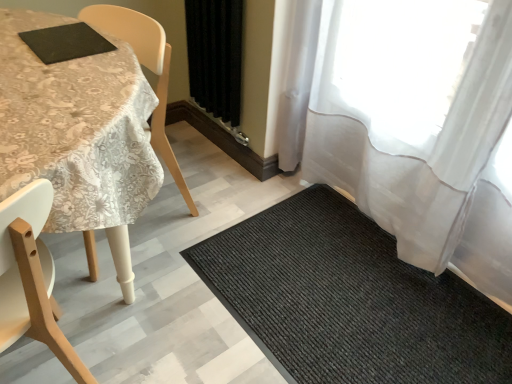
Find the location of a particular element. white lace tablecloth at upper left is located at coordinates (78, 134).

At what (x,y) coordinates should I click in order to perform the action: click on black fabric curtain at center, which ranks as the 2th curtain in right-to-left order. Please return your answer as a coordinate pair (x, y). Looking at the image, I should click on (215, 56).

What do you see at coordinates (215, 56) in the screenshot? Image resolution: width=512 pixels, height=384 pixels. I see `black fabric curtain at center, which ranks as the 2th curtain in right-to-left order` at bounding box center [215, 56].

Measure the distance between point (36, 268) and camera.

They are 30.55 inches apart.

Image resolution: width=512 pixels, height=384 pixels. What do you see at coordinates (31, 277) in the screenshot? I see `wooden chair at left` at bounding box center [31, 277].

The image size is (512, 384). Find the location of `white lace tablecloth at upper left`. white lace tablecloth at upper left is located at coordinates (78, 134).

What's the angular difference between sheer white curtain at right, placed as the 2th curtain when sorted from left to right, and black textured mat at lower right's facing directions?

The facing directions of sheer white curtain at right, placed as the 2th curtain when sorted from left to right, and black textured mat at lower right are 1.85 degrees apart.

Is sheer white curtain at right, the first curtain viewed from the right, smaller than black textured mat at lower right?

Incorrect, sheer white curtain at right, the first curtain viewed from the right, is not smaller in size than black textured mat at lower right.

From the picture: From the image's perspective, which is below, sheer white curtain at right, placed as the 2th curtain when sorted from left to right, or black textured mat at lower right?

black textured mat at lower right is shown below in the image.

Is sheer white curtain at right, placed as the 2th curtain when sorted from left to right, aimed at black textured mat at lower right?

Yes, sheer white curtain at right, placed as the 2th curtain when sorted from left to right, faces towards black textured mat at lower right.

From a real-world perspective, is black textured mat at lower right physically below wooden chair at left?

Yes.

Is wooden chair at left at the back of black textured mat at lower right?

No, wooden chair at left is not at the back of black textured mat at lower right.

From the image's perspective, is black textured mat at lower right above wooden chair at left?

No, from the image's perspective, black textured mat at lower right is not over wooden chair at left.

Is point (316, 283) behind point (11, 297)?

That is True.

Which is more to the right, sheer white curtain at right, placed as the 2th curtain when sorted from left to right, or wooden chair at left?

sheer white curtain at right, placed as the 2th curtain when sorted from left to right, is more to the right.

From a real-world perspective, which is physically above, sheer white curtain at right, placed as the 2th curtain when sorted from left to right, or wooden chair at left?

sheer white curtain at right, placed as the 2th curtain when sorted from left to right, is physically above.

From the image's perspective, who appears lower, sheer white curtain at right, placed as the 2th curtain when sorted from left to right, or wooden chair at left?

wooden chair at left appears lower in the image.

Could wooden chair at left be considered to be inside sheer white curtain at right, the first curtain viewed from the right?

No, wooden chair at left is located outside of sheer white curtain at right, the first curtain viewed from the right.

From the image's perspective, who appears lower, wooden chair at left or black fabric curtain at center, which ranks as the 2th curtain in right-to-left order?

wooden chair at left.

In terms of width, does wooden chair at left look wider or thinner when compared to black fabric curtain at center, positioned as the first curtain in left-to-right order?

In the image, wooden chair at left appears to be wider than black fabric curtain at center, positioned as the first curtain in left-to-right order.

Considering the sizes of objects wooden chair at left and black fabric curtain at center, which ranks as the 2th curtain in right-to-left order, in the image provided, who is taller, wooden chair at left or black fabric curtain at center, which ranks as the 2th curtain in right-to-left order,?

wooden chair at left.

How far apart are sheer white curtain at right, placed as the 2th curtain when sorted from left to right, and white lace tablecloth at upper left?

A distance of 37.21 inches exists between sheer white curtain at right, placed as the 2th curtain when sorted from left to right, and white lace tablecloth at upper left.

Is sheer white curtain at right, placed as the 2th curtain when sorted from left to right, oriented away from white lace tablecloth at upper left?

No.

From a real-world perspective, which object stands above the other?

In real-world perspective, sheer white curtain at right, placed as the 2th curtain when sorted from left to right, is above.

Between point (460, 165) and point (45, 74), which one is positioned behind?

The point (460, 165) is more distant.

Is black fabric curtain at center, positioned as the first curtain in left-to-right order, facing away from white lace tablecloth at upper left?

That's not correct — black fabric curtain at center, positioned as the first curtain in left-to-right order, is not looking away from white lace tablecloth at upper left.

Is the position of black fabric curtain at center, positioned as the first curtain in left-to-right order, more distant than that of white lace tablecloth at upper left?

Yes, it is.

Is the surface of black fabric curtain at center, which ranks as the 2th curtain in right-to-left order, in direct contact with white lace tablecloth at upper left?

black fabric curtain at center, which ranks as the 2th curtain in right-to-left order, is not next to white lace tablecloth at upper left, and they're not touching.

Consider the image. From the image's perspective, is black fabric curtain at center, positioned as the first curtain in left-to-right order, on top of white lace tablecloth at upper left?

Yes, from the image's perspective, black fabric curtain at center, positioned as the first curtain in left-to-right order, is over white lace tablecloth at upper left.

Where is `chair lying in front of the white lace tablecloth at upper left`? The height and width of the screenshot is (384, 512). chair lying in front of the white lace tablecloth at upper left is located at coordinates (31, 277).

From their relative heights in the image, would you say white lace tablecloth at upper left is taller or shorter than wooden chair at left?

Considering their sizes, white lace tablecloth at upper left has less height than wooden chair at left.

Can you confirm if white lace tablecloth at upper left is bigger than wooden chair at left?

Indeed, white lace tablecloth at upper left has a larger size compared to wooden chair at left.

This screenshot has height=384, width=512. In order to click on the 1st curtain above the black textured mat at lower right (from the image's perspective) in this screenshot , I will do `click(410, 112)`.

The height and width of the screenshot is (384, 512). I want to click on mat that is under the wooden chair at left (from a real-world perspective), so click(349, 300).

When comparing their distances from black fabric curtain at center, positioned as the first curtain in left-to-right order, does black textured mat at lower right or sheer white curtain at right, the first curtain viewed from the right, seem further?

Among the two, black textured mat at lower right is located further to black fabric curtain at center, positioned as the first curtain in left-to-right order.

Estimate the real-world distances between objects in this image. Which object is closer to sheer white curtain at right, placed as the 2th curtain when sorted from left to right, black fabric curtain at center, positioned as the first curtain in left-to-right order, or white lace tablecloth at upper left?

Among the two, black fabric curtain at center, positioned as the first curtain in left-to-right order, is located nearer to sheer white curtain at right, placed as the 2th curtain when sorted from left to right.

Considering their positions, is black fabric curtain at center, which ranks as the 2th curtain in right-to-left order, positioned further to sheer white curtain at right, placed as the 2th curtain when sorted from left to right, than wooden chair at left?

Among the two, wooden chair at left is located further to sheer white curtain at right, placed as the 2th curtain when sorted from left to right.

When comparing their distances from wooden chair at left, does white lace tablecloth at upper left or black fabric curtain at center, positioned as the first curtain in left-to-right order, seem further?

black fabric curtain at center, positioned as the first curtain in left-to-right order.

When comparing their distances from black textured mat at lower right, does white lace tablecloth at upper left or wooden chair at left seem closer?

white lace tablecloth at upper left lies closer to black textured mat at lower right than the other object.

Which object lies further to the anchor point wooden chair at left, sheer white curtain at right, placed as the 2th curtain when sorted from left to right, or black fabric curtain at center, positioned as the first curtain in left-to-right order?

Based on the image, black fabric curtain at center, positioned as the first curtain in left-to-right order, appears to be further to wooden chair at left.

Looking at the image, which one is located closer to black fabric curtain at center, positioned as the first curtain in left-to-right order, black textured mat at lower right or white lace tablecloth at upper left?

white lace tablecloth at upper left is positioned closer to the anchor black fabric curtain at center, positioned as the first curtain in left-to-right order.

From the image, which object appears to be farther from wooden chair at left, white lace tablecloth at upper left or black textured mat at lower right?

The object further to wooden chair at left is black textured mat at lower right.

The width and height of the screenshot is (512, 384). What are the coordinates of `mat located between wooden chair at left and sheer white curtain at right, the first curtain viewed from the right, in the left-right direction` in the screenshot? It's located at (349, 300).

Identify the location of curtain located between wooden chair at left and black fabric curtain at center, positioned as the first curtain in left-to-right order, in the depth direction. (410, 112).

Locate an element on the screen. curtain between black fabric curtain at center, which ranks as the 2th curtain in right-to-left order, and black textured mat at lower right vertically is located at coordinates (410, 112).

Find the location of a particular element. Image resolution: width=512 pixels, height=384 pixels. mat between wooden chair at left and black fabric curtain at center, positioned as the first curtain in left-to-right order, in the front-back direction is located at coordinates (349, 300).